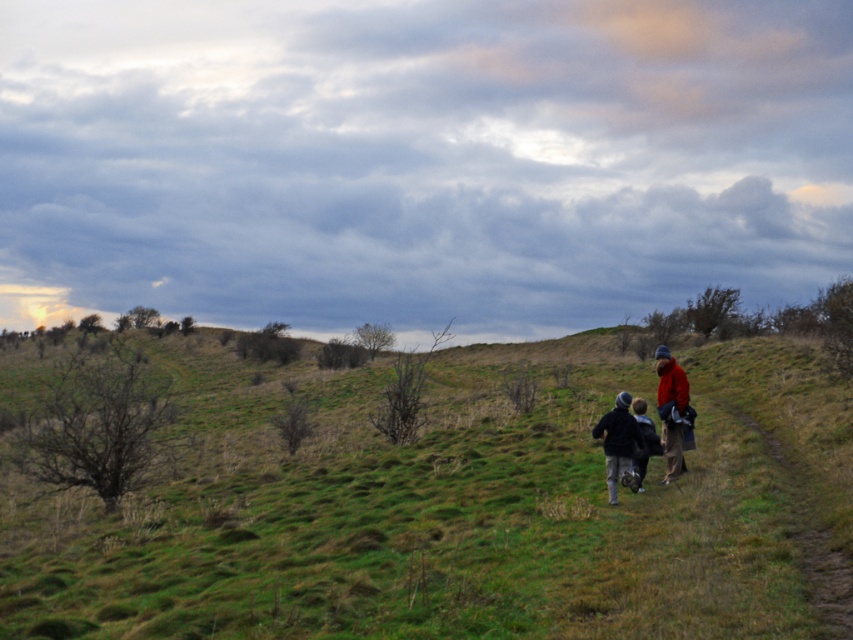
Is red woolen sweater at right above dark blue jacket at center?

Correct, red woolen sweater at right is located above dark blue jacket at center.

Can you confirm if red woolen sweater at right is thinner than dark blue jacket at center?

Incorrect, red woolen sweater at right's width is not less than dark blue jacket at center's.

Describe the element at coordinates (672, 412) in the screenshot. This screenshot has width=853, height=640. I see `red woolen sweater at right` at that location.

Where is `red woolen sweater at right`? The width and height of the screenshot is (853, 640). red woolen sweater at right is located at coordinates (672, 412).

Does dirt path at right have a greater width compared to red woolen jacket at right?

Yes, dirt path at right is wider than red woolen jacket at right.

Is point (822, 410) closer to camera compared to point (670, 406)?

No, (822, 410) is behind (670, 406).

Describe the element at coordinates (808, 525) in the screenshot. The image size is (853, 640). I see `dirt path at right` at that location.

The height and width of the screenshot is (640, 853). What are the coordinates of `dirt path at right` in the screenshot? It's located at (808, 525).

Can you confirm if dirt path at right is positioned below dark blue woolen sweater at center?

Correct, dirt path at right is located below dark blue woolen sweater at center.

Is point (809, 516) more distant than point (625, 470)?

No, (809, 516) is closer to viewer.

Which is behind, point (831, 625) or point (619, 410)?

Positioned behind is point (619, 410).

This screenshot has height=640, width=853. In order to click on dirt path at right in this screenshot , I will do (x=808, y=525).